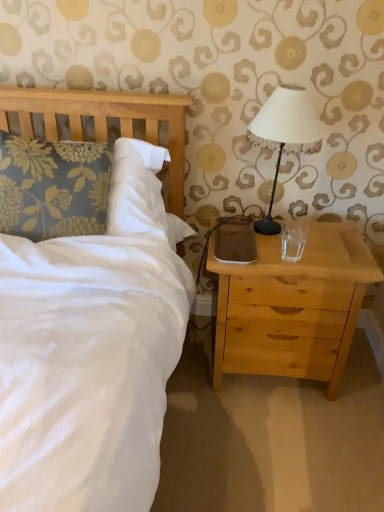
This screenshot has width=384, height=512. What do you see at coordinates (292, 307) in the screenshot? I see `light wood nightstand at right` at bounding box center [292, 307].

What is the approximate width of brown matte pad at right?

brown matte pad at right is 14.16 inches in width.

Describe the element at coordinates (235, 240) in the screenshot. I see `brown matte pad at right` at that location.

What is the approximate width of white fabric-covered lampshade at upper right?

white fabric-covered lampshade at upper right is 7.55 inches wide.

Where is `floral fabric pillow at left`? Image resolution: width=384 pixels, height=512 pixels. floral fabric pillow at left is located at coordinates (53, 187).

This screenshot has width=384, height=512. What are the coordinates of `light wood nightstand at right` in the screenshot? It's located at (292, 307).

Is brown matte pad at right a part of light wood nightstand at right?

Yes, brown matte pad at right can be found within light wood nightstand at right.

Who is taller, light wood nightstand at right or brown matte pad at right?

light wood nightstand at right is taller.

Based on the photo, in the image, is light wood nightstand at right on the left side or the right side of brown matte pad at right?

From the image, it's evident that light wood nightstand at right is to the right of brown matte pad at right.

Is light wood nightstand at right thinner than brown matte pad at right?

No.

From a real-world perspective, does brown matte pad at right sit lower than transparent glass at right?

Yes, from a real-world perspective, brown matte pad at right is under transparent glass at right.

Who is taller, brown matte pad at right or transparent glass at right?

Standing taller between the two is transparent glass at right.

From the image's perspective, does brown matte pad at right appear lower than transparent glass at right?

No.

From the picture: Which of these two, brown matte pad at right or transparent glass at right, is bigger?

With larger size is brown matte pad at right.

Between floral fabric pillow at left and brown matte pad at right, which one appears on the right side from the viewer's perspective?

brown matte pad at right is more to the right.

Would you consider floral fabric pillow at left to be distant from brown matte pad at right?

No, floral fabric pillow at left is not far away from brown matte pad at right.

What's the angular difference between floral fabric pillow at left and brown matte pad at right's facing directions?

The facing directions of floral fabric pillow at left and brown matte pad at right are 8.55 degrees apart.

Which of these two, floral fabric pillow at left or brown matte pad at right, is smaller?

brown matte pad at right.

Is floral fabric pillow at left in front of or behind transparent glass at right in the image?

floral fabric pillow at left is in front of transparent glass at right.

Is floral fabric pillow at left turned away from transparent glass at right?

floral fabric pillow at left does not have its back to transparent glass at right.

Does point (48, 229) lie behind point (284, 245)?

That is False.

Does floral fabric pillow at left have a greater width compared to transparent glass at right?

Yes.

Is floral fabric pillow at left turned away from light wood nightstand at right?

No.

Considering the relative sizes of floral fabric pillow at left and light wood nightstand at right in the image provided, is floral fabric pillow at left smaller than light wood nightstand at right?

Correct, floral fabric pillow at left occupies less space than light wood nightstand at right.

Is light wood nightstand at right located within floral fabric pillow at left?

That's incorrect, light wood nightstand at right is not inside floral fabric pillow at left.

Which is in front, point (37, 232) or point (336, 288)?

Positioned in front is point (336, 288).

Between transparent glass at right and light wood nightstand at right, which one has larger width?

With larger width is light wood nightstand at right.

Between point (290, 234) and point (279, 300), which one is positioned in front?

The point (279, 300) is more forward.

Are transparent glass at right and light wood nightstand at right making contact?

No, transparent glass at right is not touching light wood nightstand at right.

Is transparent glass at right inside the boundaries of floral fabric pillow at left, or outside?

transparent glass at right cannot be found inside floral fabric pillow at left.

From the picture: From a real-world perspective, is transparent glass at right above or below floral fabric pillow at left?

Clearly, from a real-world perspective, transparent glass at right is below floral fabric pillow at left.

Find the location of a particular element. pillow on the left of transparent glass at right is located at coordinates (53, 187).

Identify the location of nightstand that is in front of the brown matte pad at right. The height and width of the screenshot is (512, 384). (292, 307).

Find the location of `coffee cup located above the brown matte pad at right (from a real-world perspective)`. coffee cup located above the brown matte pad at right (from a real-world perspective) is located at coordinates (293, 240).

From the image, which object appears to be farther from white fabric-covered lampshade at upper right, floral fabric pillow at left or light wood nightstand at right?

Based on the image, floral fabric pillow at left appears to be further to white fabric-covered lampshade at upper right.

From the image, which object appears to be farther from transparent glass at right, light wood nightstand at right or white fabric-covered lampshade at upper right?

Based on the image, white fabric-covered lampshade at upper right appears to be further to transparent glass at right.

Considering their positions, is floral fabric pillow at left positioned closer to white fabric-covered lampshade at upper right than transparent glass at right?

Among the two, transparent glass at right is located nearer to white fabric-covered lampshade at upper right.

When comparing their distances from transparent glass at right, does light wood nightstand at right or brown matte pad at right seem further?

The object further to transparent glass at right is light wood nightstand at right.

Considering their positions, is white fabric-covered lampshade at upper right positioned further to light wood nightstand at right than brown matte pad at right?

Among the two, white fabric-covered lampshade at upper right is located further to light wood nightstand at right.

Looking at the image, which one is located further to floral fabric pillow at left, transparent glass at right or light wood nightstand at right?

transparent glass at right lies further to floral fabric pillow at left than the other object.

Considering their positions, is brown matte pad at right positioned closer to white fabric-covered lampshade at upper right than floral fabric pillow at left?

Based on the image, brown matte pad at right appears to be nearer to white fabric-covered lampshade at upper right.

Looking at the image, which one is located further to transparent glass at right, light wood nightstand at right or floral fabric pillow at left?

floral fabric pillow at left lies further to transparent glass at right than the other object.

At what (x,y) coordinates should I click in order to perform the action: click on coffee cup between white fabric-covered lampshade at upper right and light wood nightstand at right vertically. Please return your answer as a coordinate pair (x, y). The width and height of the screenshot is (384, 512). Looking at the image, I should click on (293, 240).

The height and width of the screenshot is (512, 384). I want to click on pad between floral fabric pillow at left and light wood nightstand at right, so click(235, 240).

You are a GUI agent. You are given a task and a screenshot of the screen. Output one action in this format:
    pyautogui.click(x=<x>, y=<y>)
    Task: Click on the coffee cup between brown matte pad at right and light wood nightstand at right in the vertical direction
    
    Given the screenshot: What is the action you would take?
    pyautogui.click(x=293, y=240)

Locate an element on the screen. pad between white fabric-covered lampshade at upper right and transparent glass at right vertically is located at coordinates (235, 240).